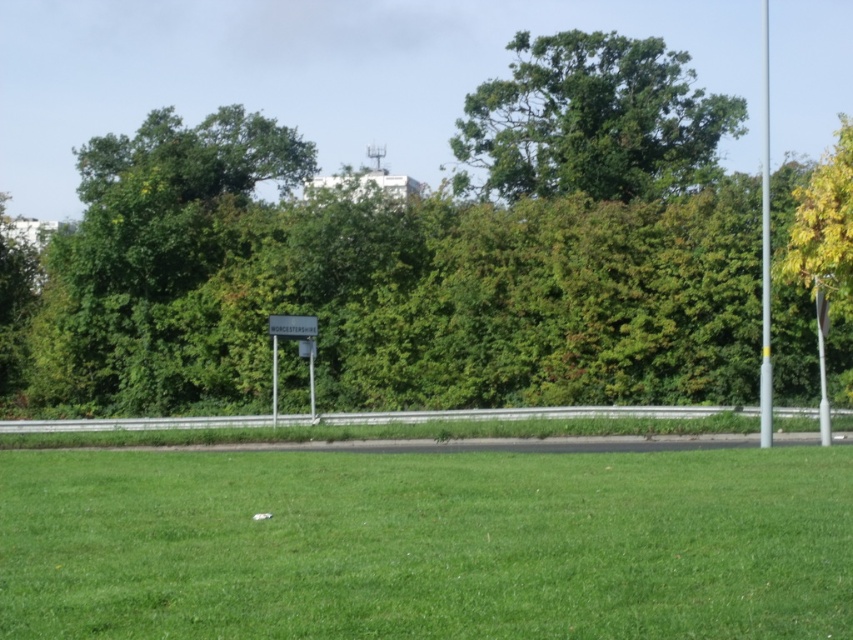
You are standing on the grassy area and looking towards the guardrail. Which green leafy tree is more to the left between the green leafy tree at center and the green leafy tree at upper center?

The green leafy tree at center is more to the left than the green leafy tree at upper center.

You are standing on the green grass at center and want to reach the green leafy tree at upper center. Which direction should you move to get closer to the tree?

To reach the green leafy tree at upper center from the green grass at center, you should move upward since the tree is positioned above the grass in the image.